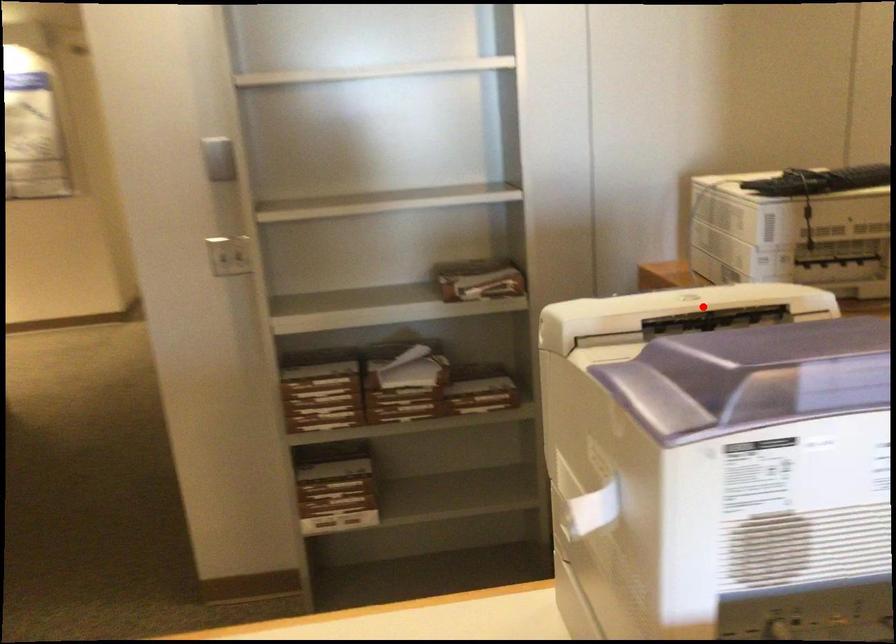
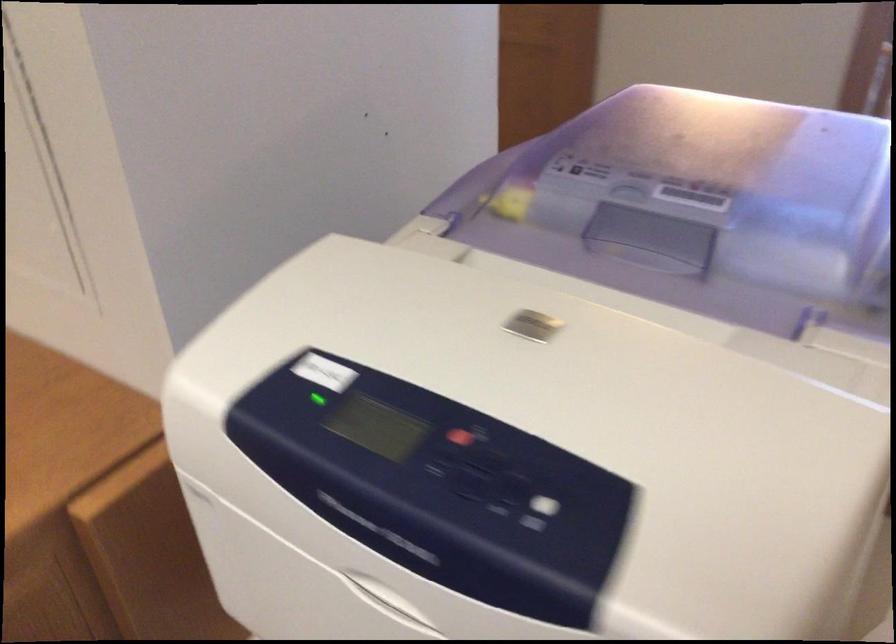
Question: I am providing you with two images of the same scene from different viewpoints. In image1, a red point is highlighted. Considering the same 3D point in image2, which of the following is correct?

Choices:
 (A) It is closer
 (B) It is farther

Answer: (A)